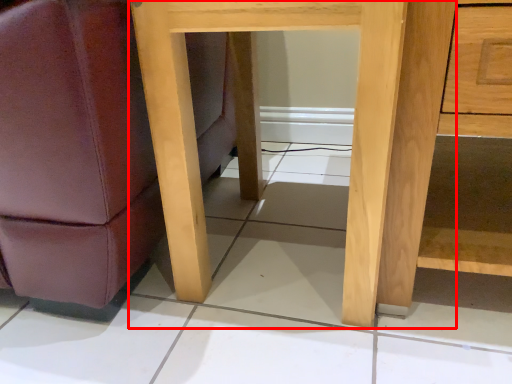
Question: Observing the image, what is the correct spatial positioning of table (annotated by the red box) in reference to dresser?

Choices:
 (A) right
 (B) left

Answer: (B)